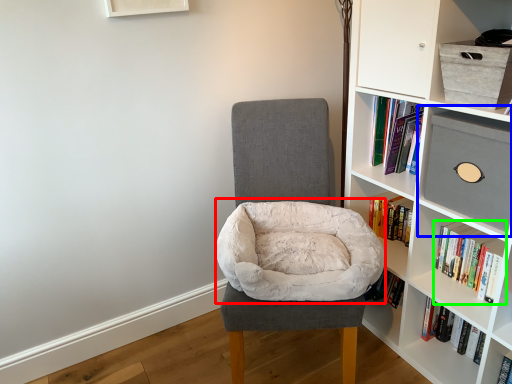
Question: Based on their relative distances, which object is farther from bean bag chair (highlighted by a red box)? Choose from shelf (highlighted by a blue box) and book (highlighted by a green box).

Choices:
 (A) shelf
 (B) book

Answer: (B)